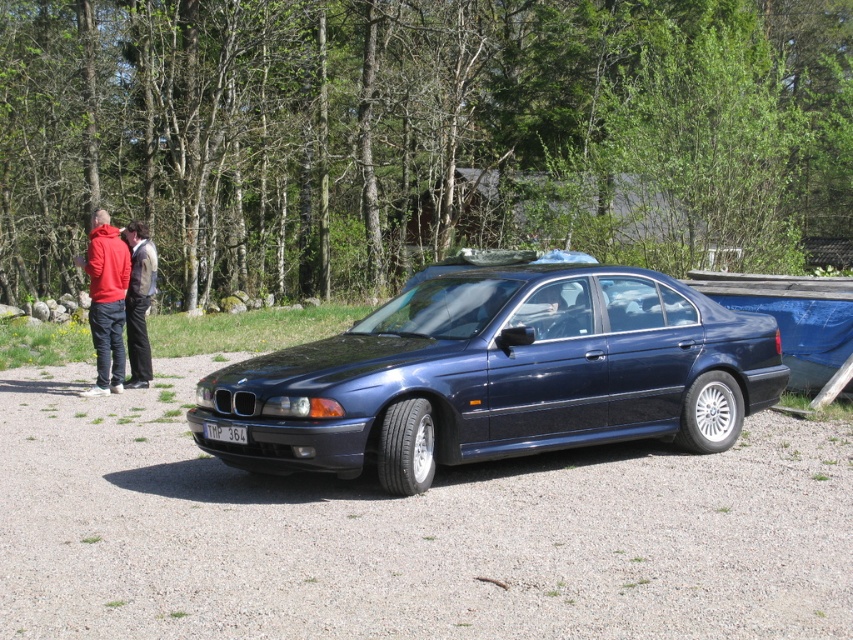
You are a delivery person who needs to place a matte red hoodie at left and a white plastic license plate at center into a storage box. The box can only hold items up to 50 cm in width. Can both items fit side by side?

The matte red hoodie at left might be wider than the white plastic license plate at center, so their combined width could exceed the box capacity. Check their exact dimensions before placing them together.

You are a pedestrian standing in the middle of the gravel path and see the matte red hoodie at left and dark blue leather jacket at left. Which clothing item is closer to you?

The matte red hoodie at left is closer to you because it is in front of the dark blue leather jacket at left.